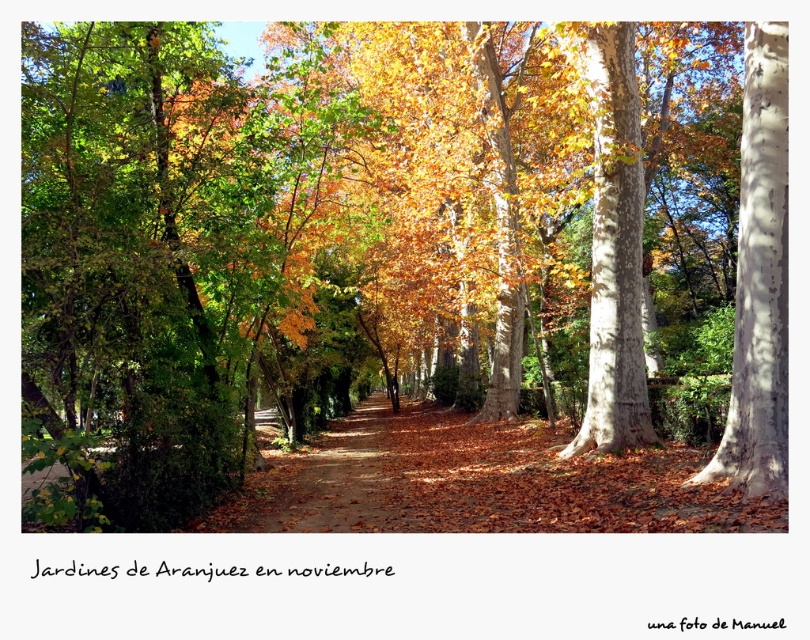
You are standing at the center of the pathway in the Jardines de Aranjuez. You want to locate the smooth white bark at center. Which direction should you look?

You should look to the right side of the pathway because the smooth white bark at center is located at point (759, 280), which is on the right side of the pathway.

You are a tourist standing at the entrance of the Jardines de Aranjuez, looking down the central pathway. You see the smooth bark tree at center and the brown dirt path at center. Which object is closer to you as you face the path?

The smooth bark tree at center is closer to you because the brown dirt path at center is behind it.

From the picture: You are planning to place a small garden bench along the brown dirt path at center. Considering the space available, can the smooth bark tree at center be positioned closer to the bench without encroaching on the path?

The smooth bark tree at center occupies less space than the brown dirt path at center, so placing the bench near the tree would leave enough space on the path. The tree does not take up as much area as the path, so it can be positioned closer without blocking the path.